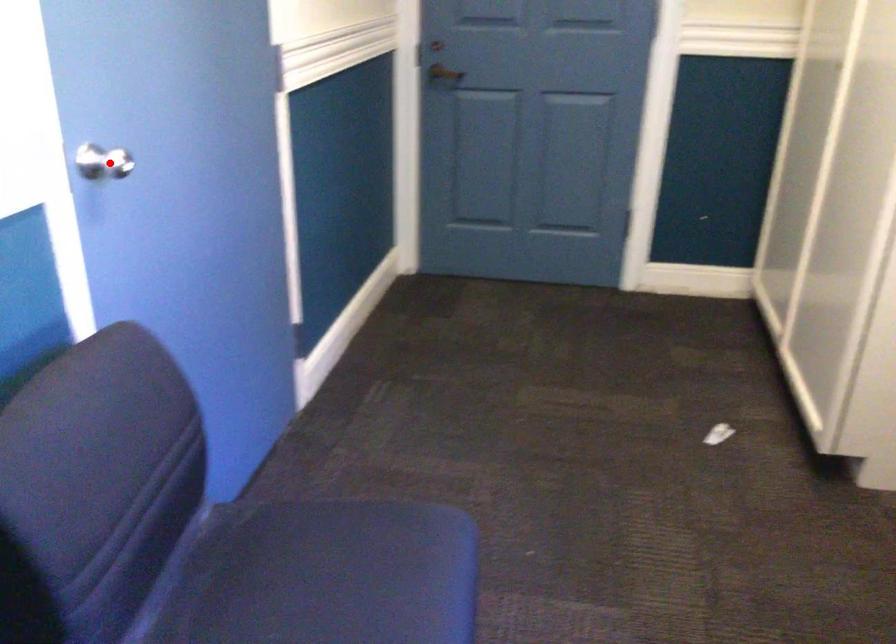
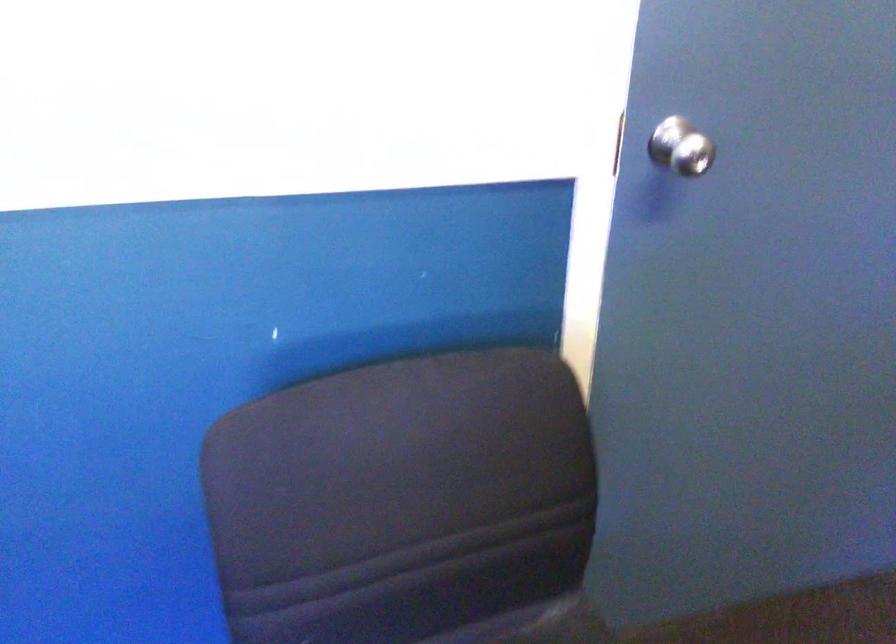
Question: I am providing you with two images of the same scene from different viewpoints. A red point is shown in image1. For the corresponding object point in image2, is it positioned nearer or farther from the camera?

Choices:
 (A) Nearer
 (B) Farther

Answer: (A)